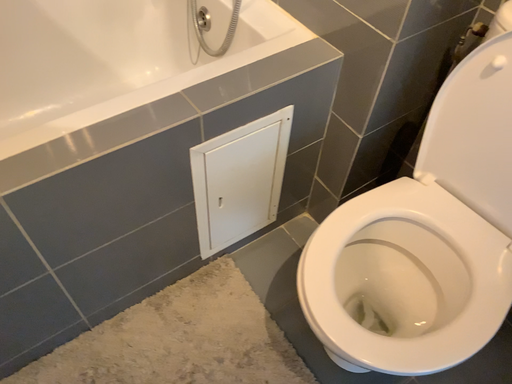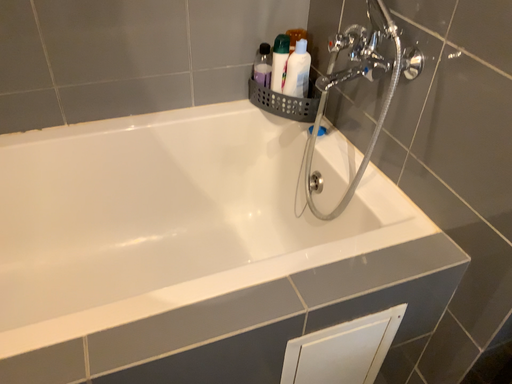
Question: How did the camera likely rotate when shooting the video?

Choices:
 (A) rotated left
 (B) rotated right

Answer: (A)